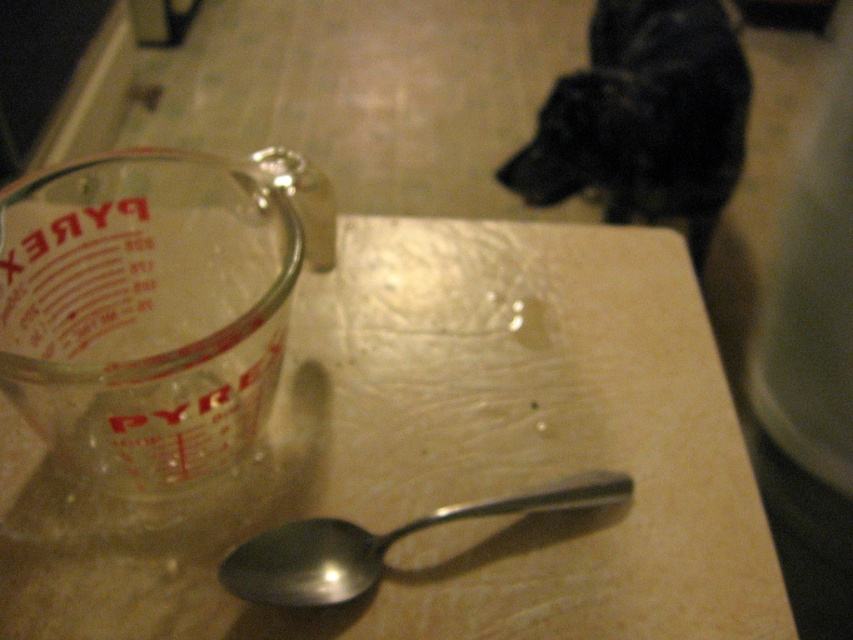
Is matte glass measuring cup at left above black fur dog at upper right?

Incorrect, matte glass measuring cup at left is not positioned above black fur dog at upper right.

Can you confirm if matte glass measuring cup at left is positioned to the left of black fur dog at upper right?

Indeed, matte glass measuring cup at left is positioned on the left side of black fur dog at upper right.

Is point (520, 580) closer to camera compared to point (631, 109)?

That is True.

Where is `matte glass measuring cup at left`? This screenshot has height=640, width=853. matte glass measuring cup at left is located at coordinates (473, 452).

Is matte glass measuring cup at left closer to camera compared to silver metallic spoon at center?

No, matte glass measuring cup at left is further to the viewer.

Does matte glass measuring cup at left have a greater height compared to silver metallic spoon at center?

Indeed, matte glass measuring cup at left has a greater height compared to silver metallic spoon at center.

Measure the distance between point (643, 548) and camera.

Point (643, 548) is 35.17 centimeters from camera.

Image resolution: width=853 pixels, height=640 pixels. In order to click on matte glass measuring cup at left in this screenshot , I will do `click(473, 452)`.

Which of these two, black fur dog at upper right or silver metallic spoon at center, stands shorter?

silver metallic spoon at center is shorter.

Does black fur dog at upper right appear under silver metallic spoon at center?

Actually, black fur dog at upper right is above silver metallic spoon at center.

Who is more forward, (712,147) or (553,506)?

Point (553,506) is more forward.

Where is `black fur dog at upper right`? The height and width of the screenshot is (640, 853). black fur dog at upper right is located at coordinates (645, 118).